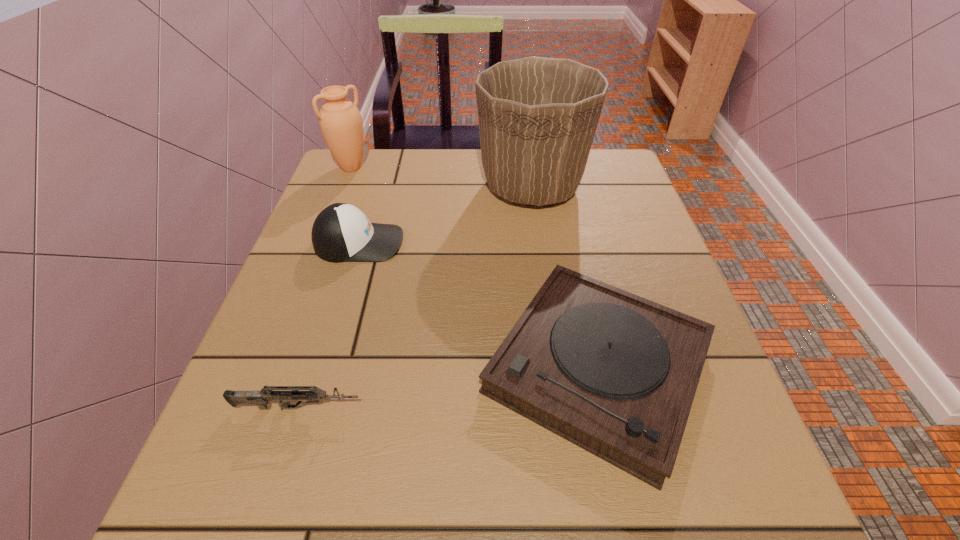
In order to click on free space located 0.230m on the left of the phonograph record in this screenshot , I will do `click(342, 367)`.

Where is `flowerpot present at the far edge`? flowerpot present at the far edge is located at coordinates (537, 116).

You are a GUI agent. You are given a task and a screenshot of the screen. Output one action in this format:
    pyautogui.click(x=<x>, y=<y>)
    Task: Click on the urn situated at the far edge
    Image resolution: width=960 pixels, height=540 pixels.
    Given the screenshot: What is the action you would take?
    pyautogui.click(x=340, y=121)

Where is `object located at the near edge`? object located at the near edge is located at coordinates (616, 374).

Locate an element on the screen. The width and height of the screenshot is (960, 540). urn located at the left edge is located at coordinates (340, 121).

I want to click on cap at the left edge, so click(x=341, y=232).

The image size is (960, 540). What are the coordinates of `gun positioned at the left edge` in the screenshot? It's located at (261, 398).

At what (x,y) coordinates should I click in order to perform the action: click on flowerpot that is positioned at the right edge. Please return your answer as a coordinate pair (x, y). This screenshot has height=540, width=960. Looking at the image, I should click on pos(537,116).

Where is `phonograph record that is at the right edge`? phonograph record that is at the right edge is located at coordinates (616, 374).

The image size is (960, 540). Find the location of `object that is at the far left corner`. object that is at the far left corner is located at coordinates (340, 121).